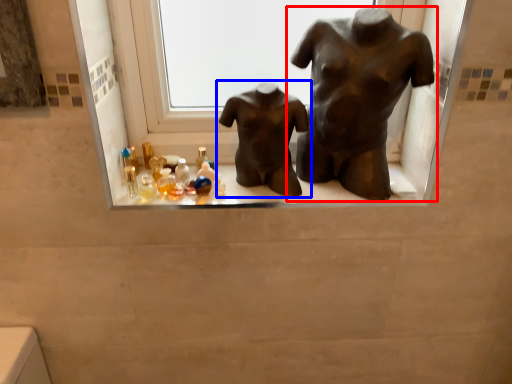
Question: Which object appears farthest to the camera in this image, statue (sculpture) (highlighted by a red box) or statue (sculpture) (highlighted by a blue box)?

Choices:
 (A) statue (sculpture)
 (B) statue (sculpture)

Answer: (B)